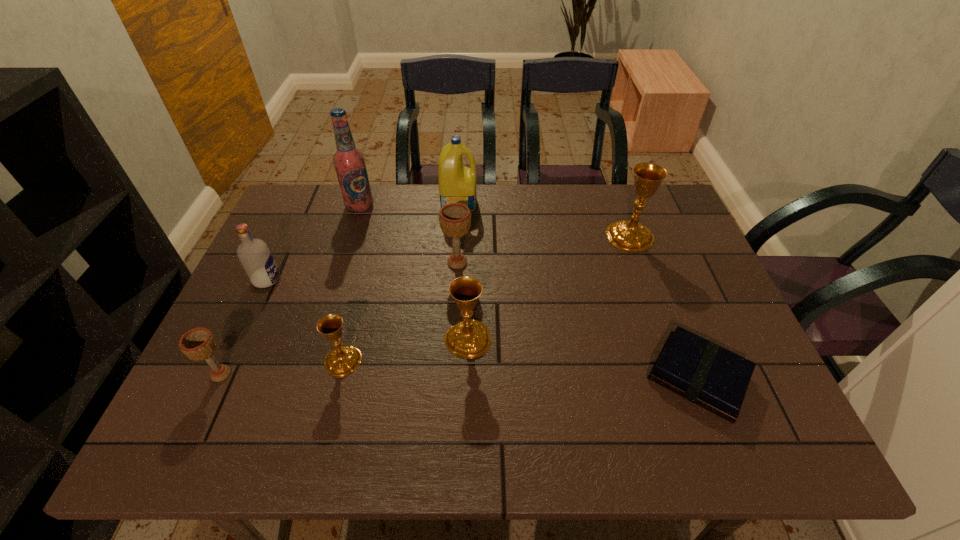
Identify the location of vacant space at the far right corner. This screenshot has width=960, height=540. (671, 222).

Where is `vacant region between the detergent and the leftmost gold chalice`? This screenshot has height=540, width=960. vacant region between the detergent and the leftmost gold chalice is located at coordinates (400, 281).

Locate an element on the screen. free spot between the biggest gold chalice and the tallest object is located at coordinates (495, 221).

Find the location of a particular element. free space between the tallest chalice and the vodka is located at coordinates (448, 258).

Locate an element on the screen. This screenshot has height=540, width=960. free space between the detergent and the vodka is located at coordinates (363, 241).

Locate an element on the screen. vacant area that lies between the second gold chalice from left to right and the vodka is located at coordinates (368, 309).

Identify the location of free spot between the book and the tallest chalice. Image resolution: width=960 pixels, height=540 pixels. (664, 307).

Where is `empty location between the farthest gold chalice and the leftmost chalice`? empty location between the farthest gold chalice and the leftmost chalice is located at coordinates (425, 305).

Image resolution: width=960 pixels, height=540 pixels. Find the location of `vacant space that's between the detergent and the smallest gold chalice`. vacant space that's between the detergent and the smallest gold chalice is located at coordinates (400, 281).

Where is `the sixth closest object to the farthest gold chalice`? The width and height of the screenshot is (960, 540). the sixth closest object to the farthest gold chalice is located at coordinates (343, 360).